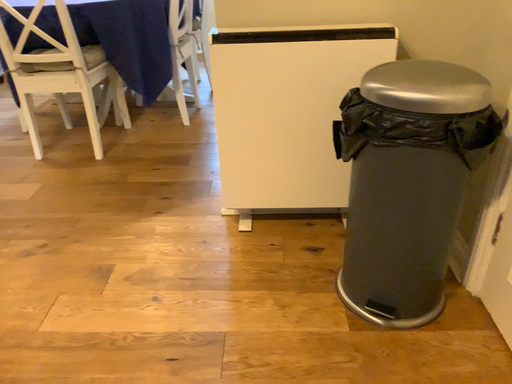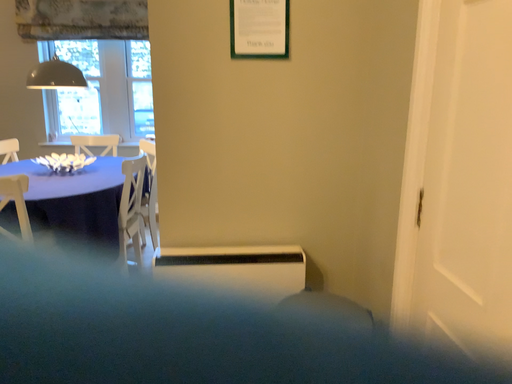
Question: How did the camera likely rotate when shooting the video?

Choices:
 (A) rotated downward
 (B) rotated upward

Answer: (B)